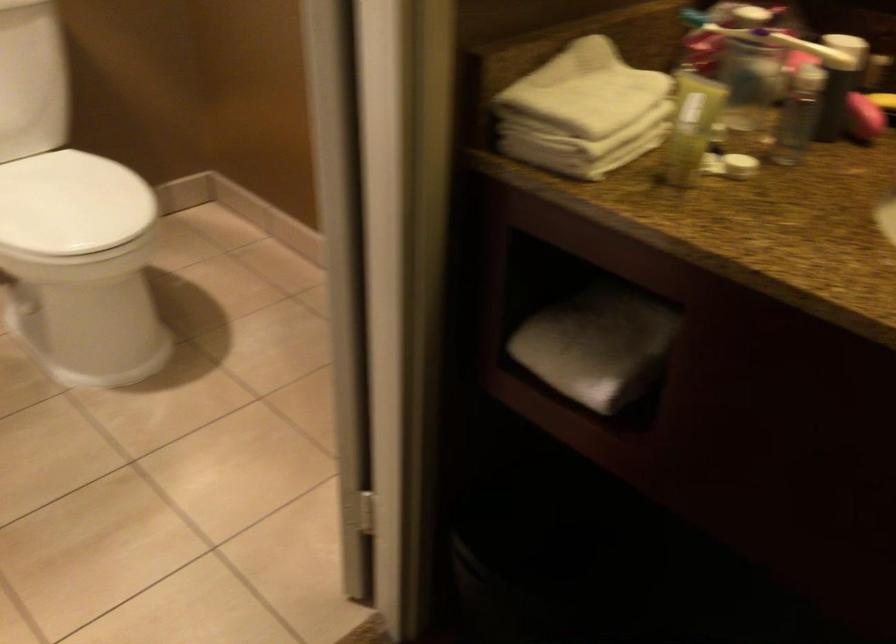
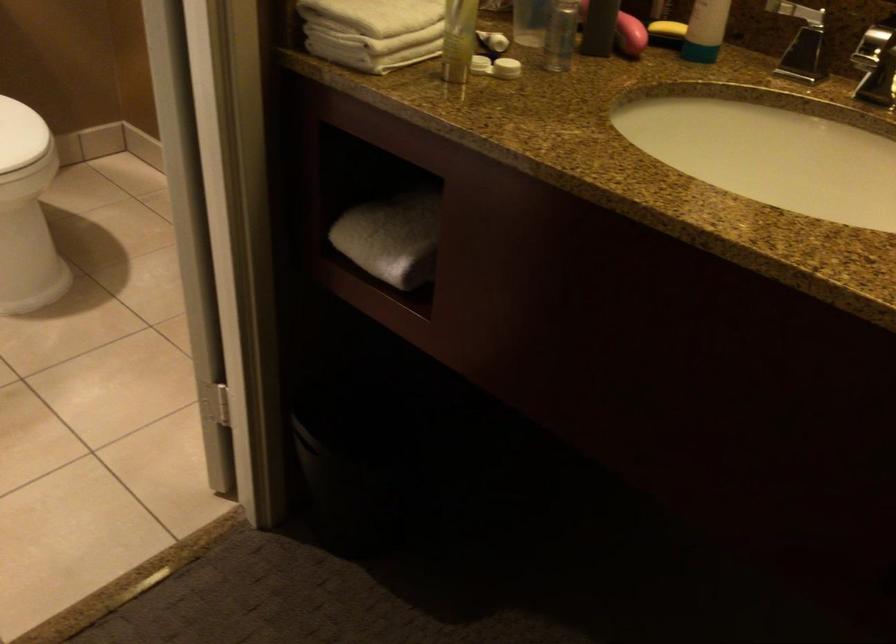
Find the pixel in the second image that matches (582,154) in the first image.

(366, 51)